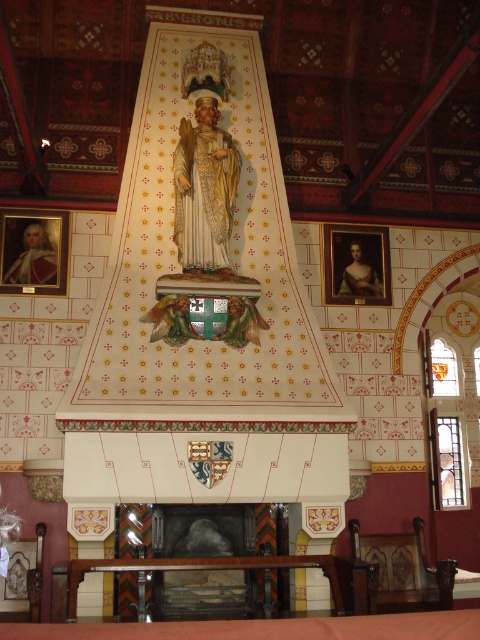
Describe the element at coordinates (203, 531) in the screenshot. I see `dark gray stone fireplace at center` at that location.

Is dark gray stone fireplace at center closer to camera compared to matte gold frame at upper left?

Yes, it is.

Does point (220, 531) lie in front of point (12, 253)?

Yes.

The width and height of the screenshot is (480, 640). What are the coordinates of `dark gray stone fireplace at center` in the screenshot? It's located at (203, 531).

Does matte gold frame at upper left appear under matte gold portrait at upper right?

No.

Where is `matte gold frame at upper left`? This screenshot has width=480, height=640. matte gold frame at upper left is located at coordinates (34, 252).

Can you confirm if dark gray stone fireplace at center is positioned to the right of matte gold portrait at upper right?

Incorrect, dark gray stone fireplace at center is not on the right side of matte gold portrait at upper right.

Can you confirm if dark gray stone fireplace at center is bigger than matte gold portrait at upper right?

Actually, dark gray stone fireplace at center might be smaller than matte gold portrait at upper right.

Between point (225, 580) and point (346, 228), which one is positioned behind?

Positioned behind is point (346, 228).

The height and width of the screenshot is (640, 480). What are the coordinates of `dark gray stone fireplace at center` in the screenshot? It's located at (203, 531).